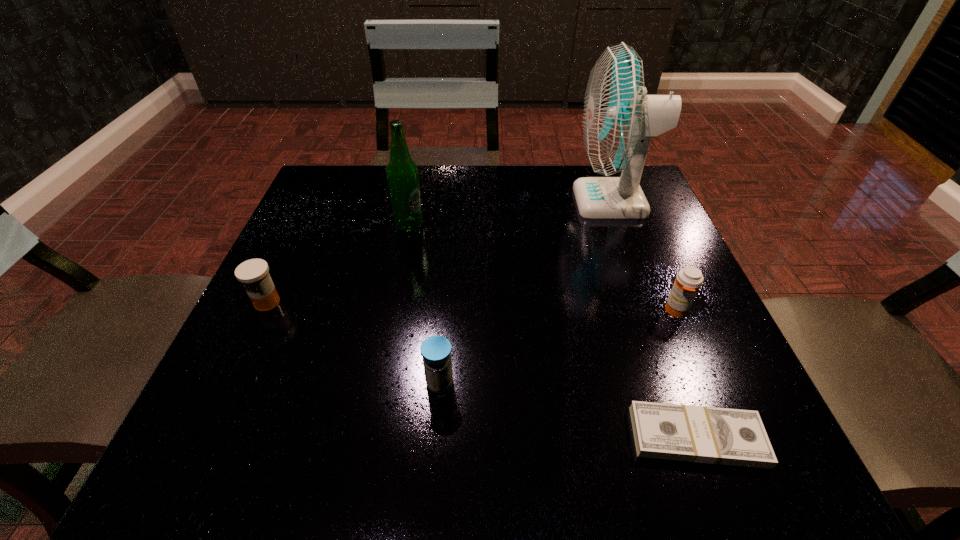
In order to click on free space between the nearest object and the fourth object from right to left in this screenshot , I will do `click(568, 410)`.

The height and width of the screenshot is (540, 960). Find the location of `vacant area that lies between the leftmost medicine and the second medicine from left to right`. vacant area that lies between the leftmost medicine and the second medicine from left to right is located at coordinates (353, 342).

Identify the location of unoccupied area between the second medicine from right to left and the dollar. (568, 410).

Select which object is the third closest to the second tallest object. Please provide its 2D coordinates. Your answer should be formatted as a tuple, i.e. [(x, y)], where the tuple contains the x and y coordinates of a point satisfying the conditions above.

[(436, 350)]

Identify the location of object that stands as the fourth closest to the nearest object. This screenshot has width=960, height=540. point(402,174).

This screenshot has width=960, height=540. I want to click on medicine that is the closest one to the leftmost medicine, so click(x=436, y=350).

Find the location of `medicine that can be found as the closest to the third object from left to right`. medicine that can be found as the closest to the third object from left to right is located at coordinates (253, 273).

Identify the location of free location that satisfies the following two spatial constraints: 1. on the label of the leftmost object; 2. on the back side of the nearest object. The image size is (960, 540). pos(204,437).

Find the location of a particular element. The height and width of the screenshot is (540, 960). vacant position in the image that satisfies the following two spatial constraints: 1. on the label of the rightmost medicine; 2. on the left side of the second object from left to right is located at coordinates (394, 310).

Where is `free space that satisfies the following two spatial constraints: 1. on the label of the leftmost object; 2. on the right side of the rightmost medicine`? The image size is (960, 540). free space that satisfies the following two spatial constraints: 1. on the label of the leftmost object; 2. on the right side of the rightmost medicine is located at coordinates (263, 310).